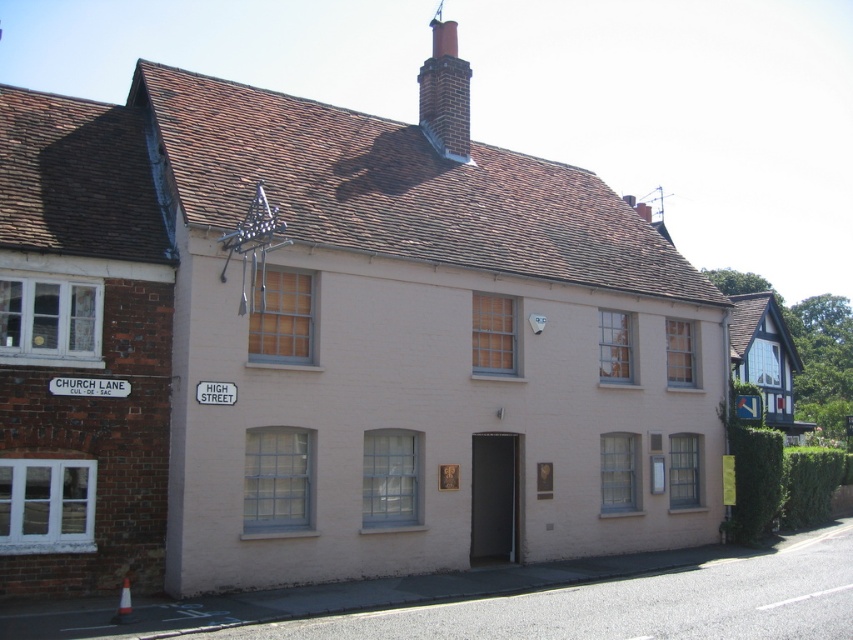
Question: Is brick chimney at upper center above white plastic street sign at upper left?

Choices:
 (A) no
 (B) yes

Answer: (B)

Question: Does brick chimney at upper center lie behind white plastic street sign at upper left?

Choices:
 (A) no
 (B) yes

Answer: (B)

Question: Which point is farther from the camera taking this photo?

Choices:
 (A) (426, 96)
 (B) (68, 384)

Answer: (A)

Question: Is brick chimney at upper center further to the viewer compared to white plastic street sign at upper left?

Choices:
 (A) no
 (B) yes

Answer: (B)